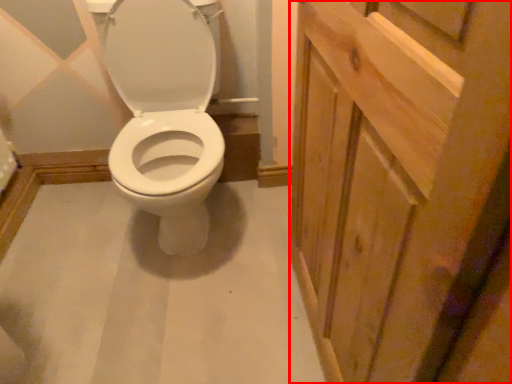
Question: Observing the image, what is the correct spatial positioning of screen door (annotated by the red box) in reference to sit?

Choices:
 (A) right
 (B) left

Answer: (A)